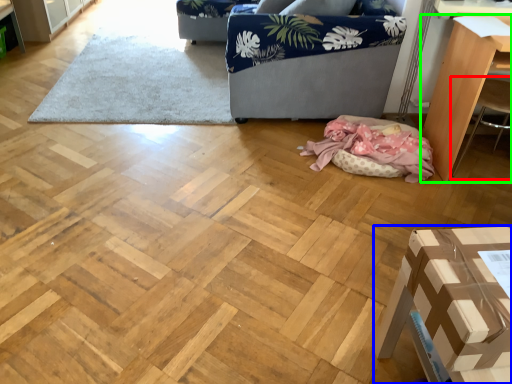
Question: Based on their relative distances, which object is farther from armchair (highlighted by a red box)? Choose from furniture (highlighted by a blue box) and furniture (highlighted by a green box).

Choices:
 (A) furniture
 (B) furniture

Answer: (A)